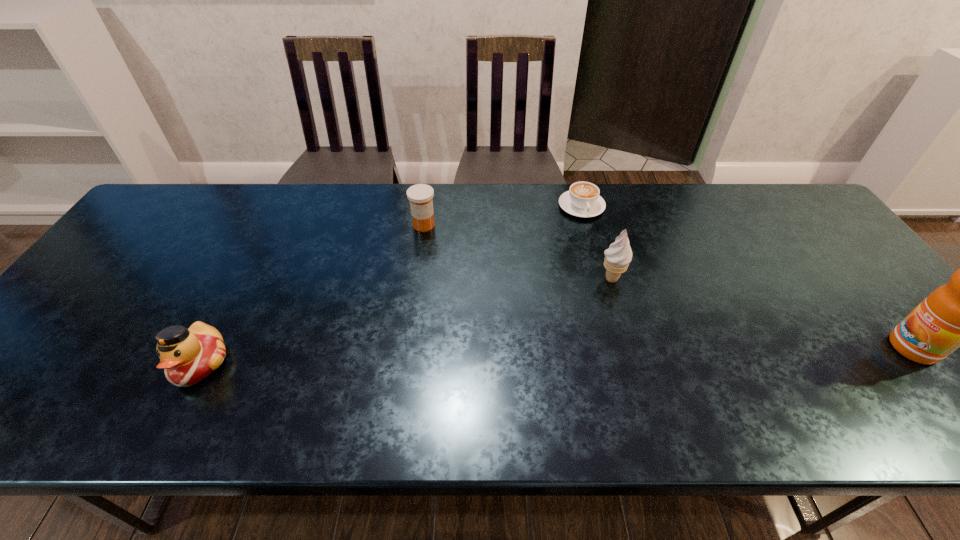
Identify the location of medicine at the far edge. The height and width of the screenshot is (540, 960). (420, 195).

I want to click on duck at the near edge, so click(187, 356).

Identify the location of fruit juice that is at the near edge. Image resolution: width=960 pixels, height=540 pixels. (958, 314).

Where is `object at the right edge`? The image size is (960, 540). object at the right edge is located at coordinates (958, 314).

I want to click on object present at the near right corner, so pos(958,314).

Locate an element on the screen. Image resolution: width=960 pixels, height=540 pixels. vacant space at the far edge of the desktop is located at coordinates (340, 222).

Where is `vacant area at the near edge of the desktop`? The height and width of the screenshot is (540, 960). vacant area at the near edge of the desktop is located at coordinates (785, 387).

Locate an element on the screen. The image size is (960, 540). blank space at the left edge of the desktop is located at coordinates (136, 242).

Find the location of a particular element. free location at the right edge of the desktop is located at coordinates [801, 255].

The height and width of the screenshot is (540, 960). In the image, there is a desktop. Identify the location of vacant region at the far left corner. (202, 191).